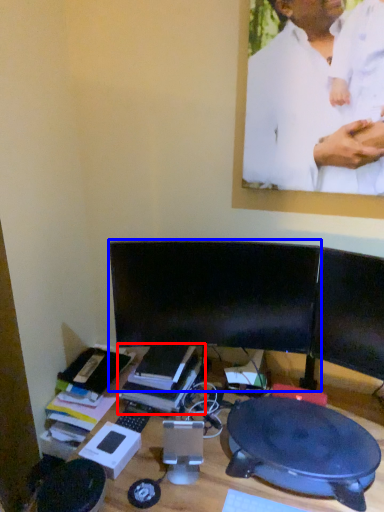
Question: Which point is further to the camera, book (highlighted by a red box) or computer monitor (highlighted by a blue box)?

Choices:
 (A) book
 (B) computer monitor

Answer: (A)